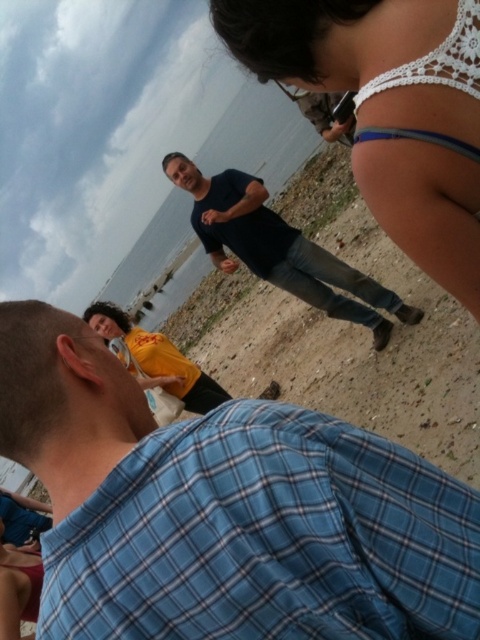
Question: Is brown sandy beach at center bigger than dark blue shirt at center?

Choices:
 (A) no
 (B) yes

Answer: (B)

Question: Which object appears farthest from the camera in this image?

Choices:
 (A) white crochet bikini top at upper right
 (B) yellow t-shirt at lower left
 (C) brown sandy beach at center

Answer: (B)

Question: Among these points, which one is nearest to the camera?

Choices:
 (A) (92, 305)
 (B) (336, 486)
 (C) (339, 269)
 (D) (0, 602)

Answer: (B)

Question: Can you confirm if brown sandy beach at center is wider than white lace tank top at upper right?

Choices:
 (A) yes
 (B) no

Answer: (A)

Question: Among these objects, which one is nearest to the camera?

Choices:
 (A) white crochet bikini top at upper right
 (B) brown sandy beach at center
 (C) white lace tank top at upper right

Answer: (A)

Question: Is blue plaid shirt at lower left to the right of white crochet bikini top at upper right from the viewer's perspective?

Choices:
 (A) no
 (B) yes

Answer: (A)